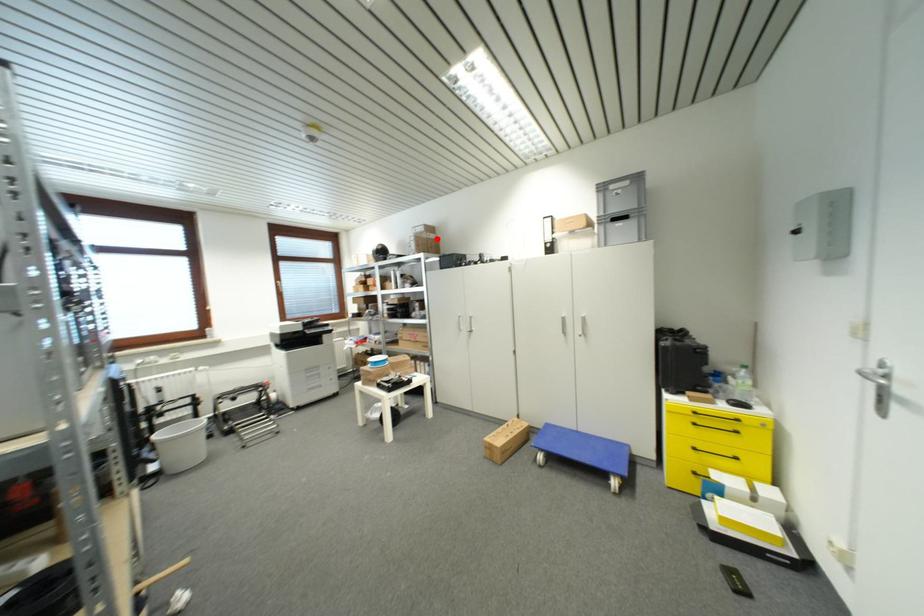
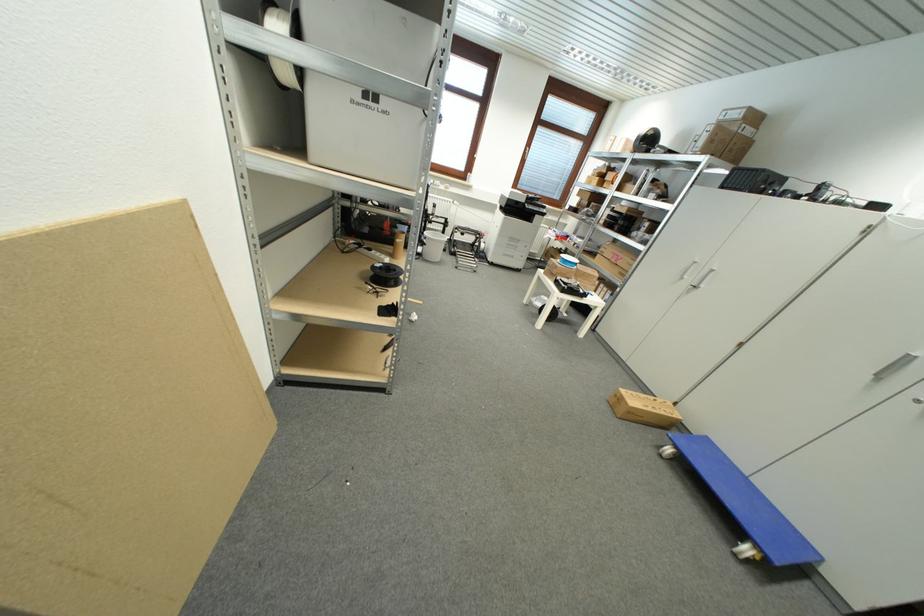
Question: I am providing you with two images of the same scene from different viewpoints. A red point is shown in image1. For the corresponding object point in image2, is it positioned nearer or farther from the camera?

Choices:
 (A) Nearer
 (B) Farther

Answer: (B)